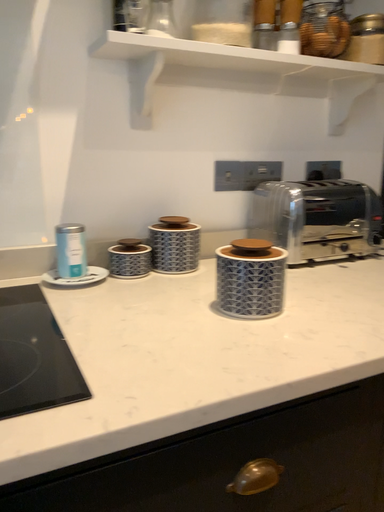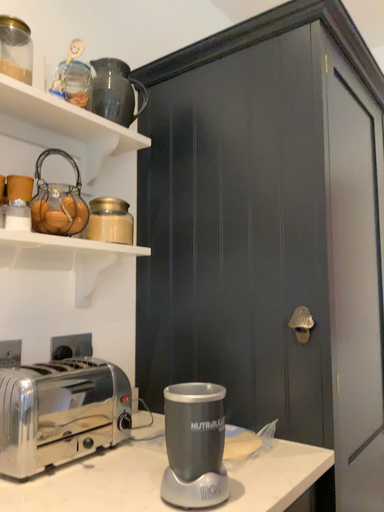
Question: Which way did the camera rotate in the video?

Choices:
 (A) rotated right
 (B) rotated left

Answer: (A)